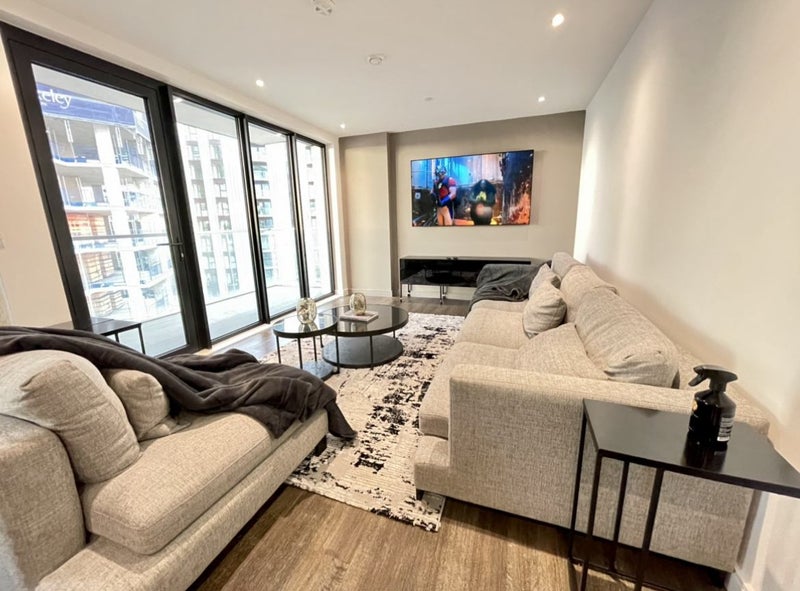
Where is `tv stand`? Image resolution: width=800 pixels, height=591 pixels. tv stand is located at coordinates (437, 282).